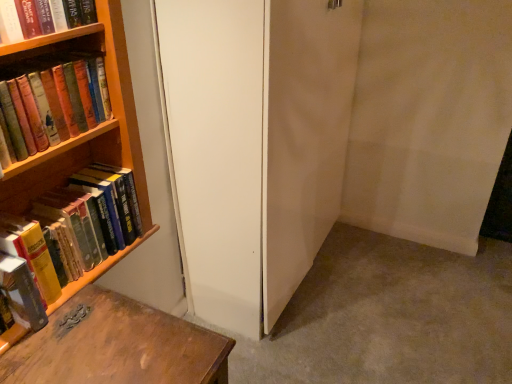
Question: Does hardcover books at left, which is the 2th book in bottom-to-top order, have a greater height compared to hardcover book at left, the first book in the bottom-to-top sequence?

Choices:
 (A) yes
 (B) no

Answer: (A)

Question: From the image's perspective, is hardcover books at left, marked as the 3th book in a top-to-bottom arrangement, over hardcover book at left, the first book in the bottom-to-top sequence?

Choices:
 (A) no
 (B) yes

Answer: (B)

Question: Is hardcover books at left, which is the 2th book in bottom-to-top order, at the left side of hardcover book at left, the first book in the bottom-to-top sequence?

Choices:
 (A) no
 (B) yes

Answer: (A)

Question: Is hardcover books at left, marked as the 3th book in a top-to-bottom arrangement, oriented away from hardcover book at left, positioned as the fourth book in top-to-bottom order?

Choices:
 (A) no
 (B) yes

Answer: (A)

Question: From the image's perspective, is hardcover books at left, which is the 2th book in bottom-to-top order, beneath hardcover book at left, positioned as the fourth book in top-to-bottom order?

Choices:
 (A) yes
 (B) no

Answer: (B)

Question: From the image's perspective, relative to hardcover books at left, which appears as the 3th book when ordered from the bottom, is hardcover books at left, marked as the 3th book in a top-to-bottom arrangement, above or below?

Choices:
 (A) above
 (B) below

Answer: (B)

Question: Is hardcover books at left, which is the 2th book in bottom-to-top order, in front of or behind hardcover books at left, marked as the 2th book in a top-to-bottom arrangement, in the image?

Choices:
 (A) front
 (B) behind

Answer: (B)

Question: Is hardcover books at left, which is the 2th book in bottom-to-top order, taller or shorter than hardcover books at left, marked as the 2th book in a top-to-bottom arrangement?

Choices:
 (A) tall
 (B) short

Answer: (A)

Question: Is hardcover books at left, marked as the 3th book in a top-to-bottom arrangement, wider or thinner than hardcover books at left, which appears as the 3th book when ordered from the bottom?

Choices:
 (A) wide
 (B) thin

Answer: (A)

Question: Looking at their shapes, would you say hardcover book at upper left, which is the 4th book in bottom-to-top order, is wider or thinner than hardcover book at left, positioned as the fourth book in top-to-bottom order?

Choices:
 (A) thin
 (B) wide

Answer: (A)

Question: From the image's perspective, is hardcover book at upper left, which is the 4th book in bottom-to-top order, positioned above or below hardcover book at left, the first book in the bottom-to-top sequence?

Choices:
 (A) above
 (B) below

Answer: (A)

Question: Is hardcover book at upper left, marked as the first book in a top-to-bottom arrangement, taller or shorter than hardcover book at left, the first book in the bottom-to-top sequence?

Choices:
 (A) short
 (B) tall

Answer: (A)

Question: Based on their sizes in the image, would you say hardcover book at upper left, which is the 4th book in bottom-to-top order, is bigger or smaller than hardcover book at left, the first book in the bottom-to-top sequence?

Choices:
 (A) big
 (B) small

Answer: (A)

Question: Is white matte screen door at center wider or thinner than hardcover books at left, which appears as the 3th book when ordered from the bottom?

Choices:
 (A) wide
 (B) thin

Answer: (A)

Question: In terms of height, does white matte screen door at center look taller or shorter compared to hardcover books at left, marked as the 2th book in a top-to-bottom arrangement?

Choices:
 (A) short
 (B) tall

Answer: (B)